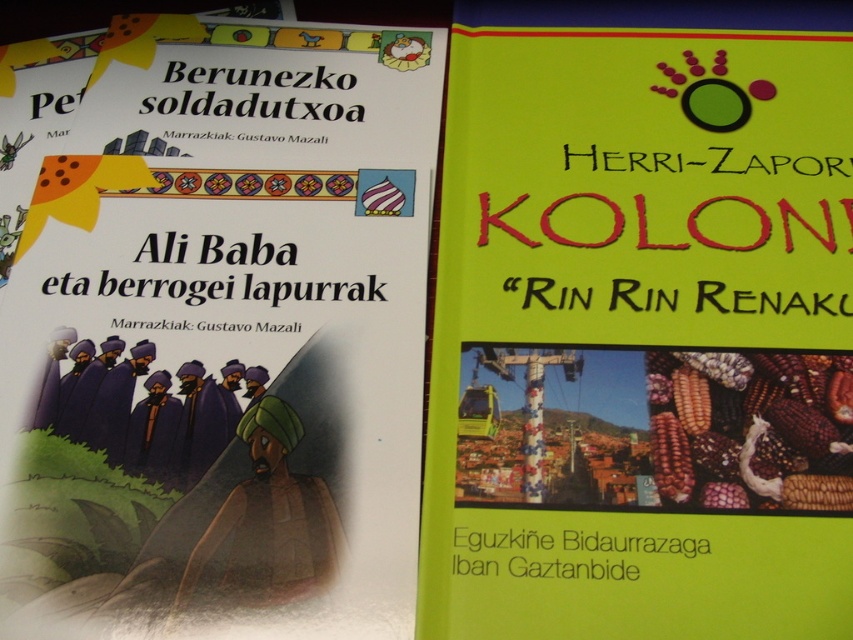
Is green matte book cover at right below matte paper book cover at left?

No, green matte book cover at right is not below matte paper book cover at left.

Who is higher up, green matte book cover at right or matte paper book cover at left?

green matte book cover at right is higher up.

Where is `green matte book cover at right`? green matte book cover at right is located at coordinates (642, 324).

The width and height of the screenshot is (853, 640). Find the location of `green matte book cover at right`. green matte book cover at right is located at coordinates (642, 324).